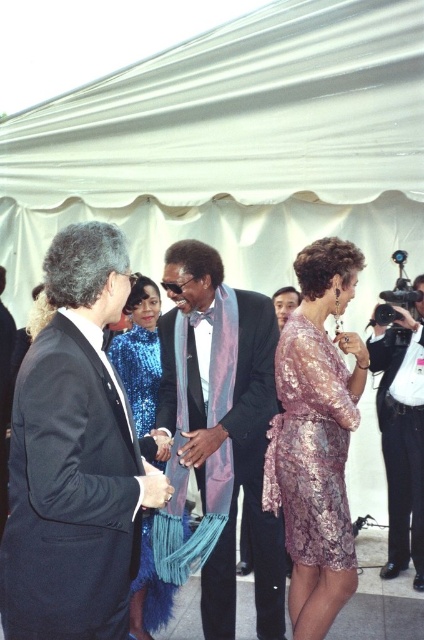
Question: Can you confirm if dark blue suit at left is positioned to the right of blue sequined dress at center?

Choices:
 (A) yes
 (B) no

Answer: (A)

Question: Among these points, which one is farthest from the camera?

Choices:
 (A) (180, 472)
 (B) (412, 120)
 (C) (407, 548)
 (D) (111, 356)

Answer: (B)

Question: Among these objects, which one is farthest from the camera?

Choices:
 (A) shiny blue scarf at center
 (B) blue sequined dress at center
 (C) black leather jacket at right
 (D) dark blue suit at left

Answer: (C)

Question: Is dark blue suit at left to the left of lavender sequined dress at center from the viewer's perspective?

Choices:
 (A) no
 (B) yes

Answer: (B)

Question: Does lavender sequined dress at center have a larger size compared to blue sequined dress at center?

Choices:
 (A) no
 (B) yes

Answer: (B)

Question: Which of the following is the farthest from the observer?

Choices:
 (A) (39, 588)
 (B) (111, 90)

Answer: (B)